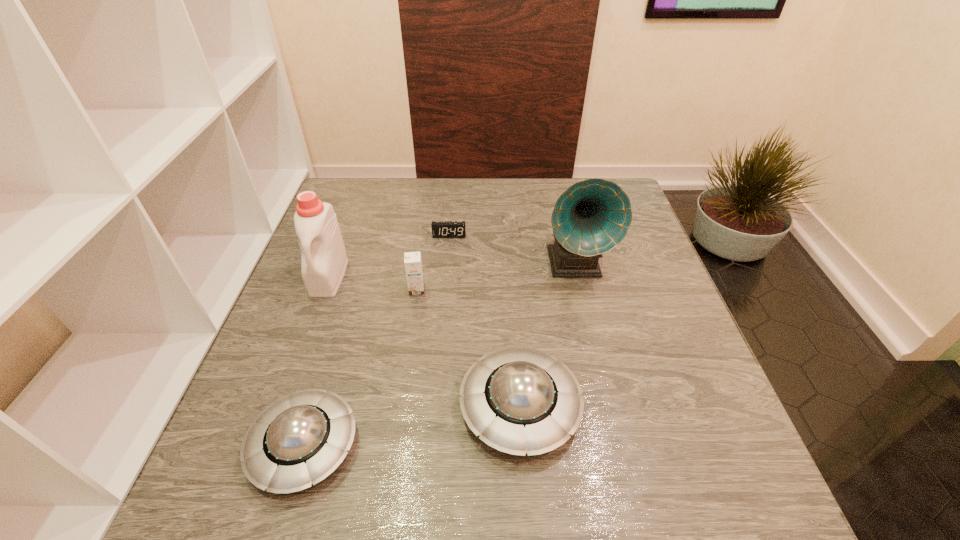
The width and height of the screenshot is (960, 540). Find the location of `free space at the right edge`. free space at the right edge is located at coordinates (620, 288).

Image resolution: width=960 pixels, height=540 pixels. Identify the location of free spot at the far left corner of the desktop. (370, 204).

Locate an element on the screen. This screenshot has width=960, height=540. unoccupied area between the taller saucer and the detergent is located at coordinates (424, 342).

Identify the location of free space between the phonograph_record and the farthest object. (512, 250).

Find the location of a particular element. The height and width of the screenshot is (540, 960). free spot between the fourth object from left to right and the fourth object from right to left is located at coordinates (433, 262).

Locate an element on the screen. The image size is (960, 540). vacant point located between the tallest object and the farthest object is located at coordinates (512, 250).

You are a GUI agent. You are given a task and a screenshot of the screen. Output one action in this format:
    pyautogui.click(x=<x>, y=<y>)
    Task: Click on the vacant point located between the alarm clock and the chocolate milk
    Image resolution: width=960 pixels, height=540 pixels.
    Given the screenshot: What is the action you would take?
    pyautogui.click(x=433, y=262)

Locate an element on the screen. empty location between the taller saucer and the phonograph_record is located at coordinates (547, 335).

Image resolution: width=960 pixels, height=540 pixels. I want to click on unoccupied area between the phonograph_record and the shorter saucer, so click(440, 355).

Where is `empty space that is in between the right saucer and the shorter saucer`? This screenshot has height=540, width=960. empty space that is in between the right saucer and the shorter saucer is located at coordinates (412, 426).